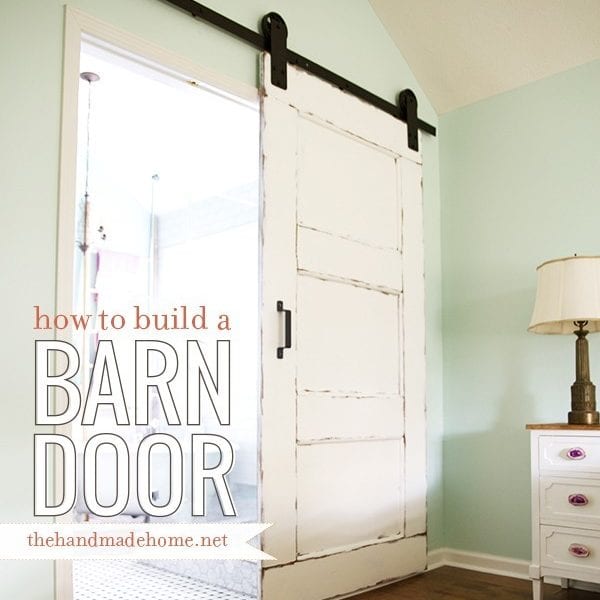
Identify the location of door. The height and width of the screenshot is (600, 600). (x=331, y=373).